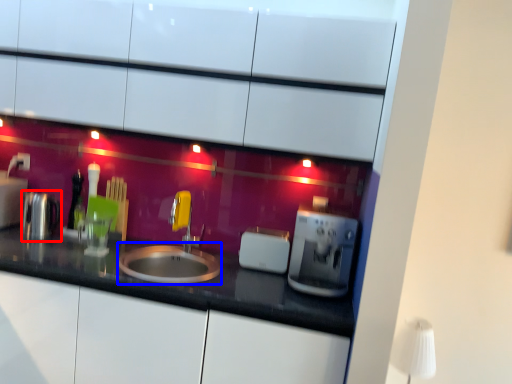
Question: Which object appears farthest to the camera in this image, appliance (highlighted by a red box) or sink (highlighted by a blue box)?

Choices:
 (A) appliance
 (B) sink

Answer: (A)